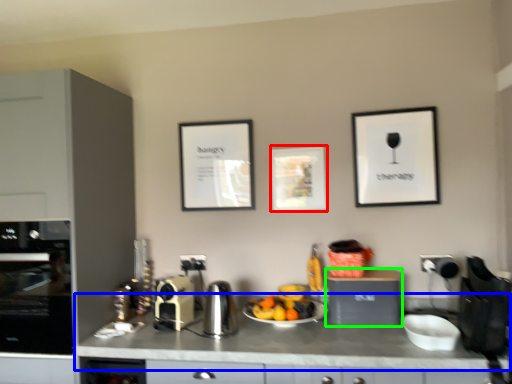
Question: Considering the real-world distances, which object is closest to picture frame (highlighted by a red box)? countertop (highlighted by a blue box) or cabinetry (highlighted by a green box).

Choices:
 (A) countertop
 (B) cabinetry

Answer: (B)